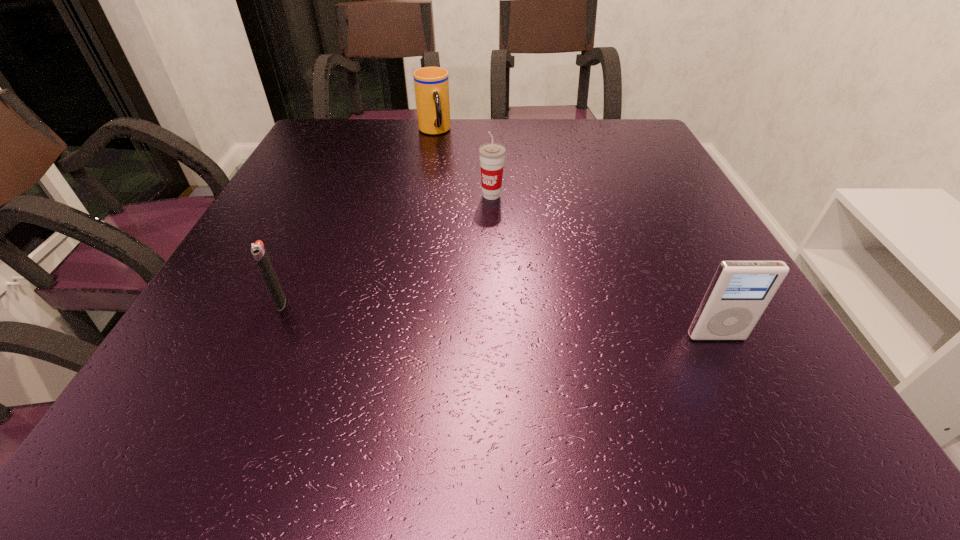
Where is `free space between the nearer cup and the igniter`? free space between the nearer cup and the igniter is located at coordinates (386, 248).

Identify the location of free space between the iPod and the leftmost object. This screenshot has width=960, height=540. (498, 319).

Locate an element on the screen. The height and width of the screenshot is (540, 960). vacant space that's between the left cup and the leftmost object is located at coordinates (357, 217).

What are the coordinates of `free space between the third object from right to left and the rightmost object` in the screenshot? It's located at (575, 234).

Where is `empty space that is in between the shortest object and the iPod`? The image size is (960, 540). empty space that is in between the shortest object and the iPod is located at coordinates (x=498, y=319).

Locate an element on the screen. The width and height of the screenshot is (960, 540). vacant point located between the nearer cup and the igniter is located at coordinates (386, 248).

You are a GUI agent. You are given a task and a screenshot of the screen. Output one action in this format:
    pyautogui.click(x=<x>, y=<y>)
    Task: Click on the second closest object to the leftmost object
    The width and height of the screenshot is (960, 540).
    Given the screenshot: What is the action you would take?
    pyautogui.click(x=431, y=84)

Find the location of a particular element. The width and height of the screenshot is (960, 540). object that is the second closest to the second farthest object is located at coordinates coord(258,250).

In order to click on vacant area in the image that satisfies the following two spatial constraints: 1. on the back side of the third object from right to left; 2. on the left side of the shortest object in this screenshot , I will do `click(358, 131)`.